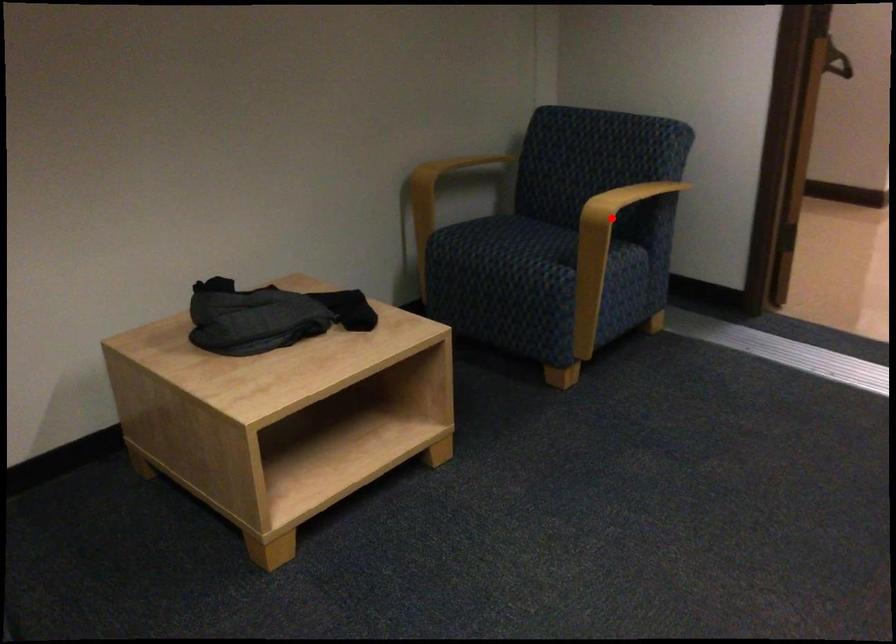
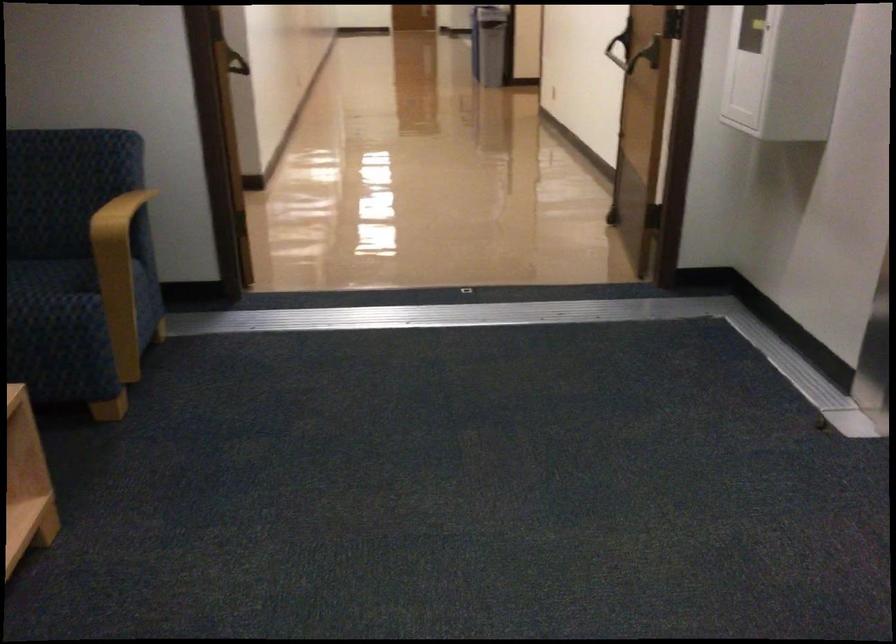
Question: A red point is marked in image1. In image2, is the corresponding 3D point closer to the camera or farther? Reply with the corresponding letter.

Choices:
 (A) The corresponding 3D point is closer.
 (B) The corresponding 3D point is farther.

Answer: (A)